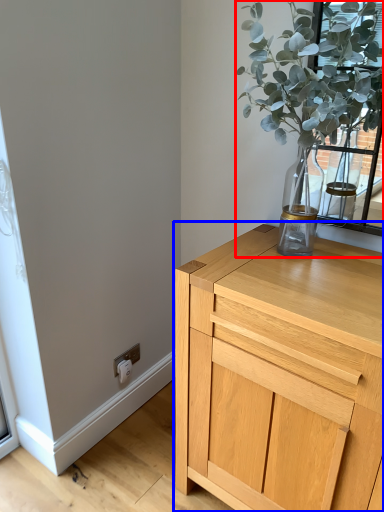
Question: Which of the following is the farthest to the observer, houseplant (highlighted by a red box) or chest of drawers (highlighted by a blue box)?

Choices:
 (A) houseplant
 (B) chest of drawers

Answer: (B)